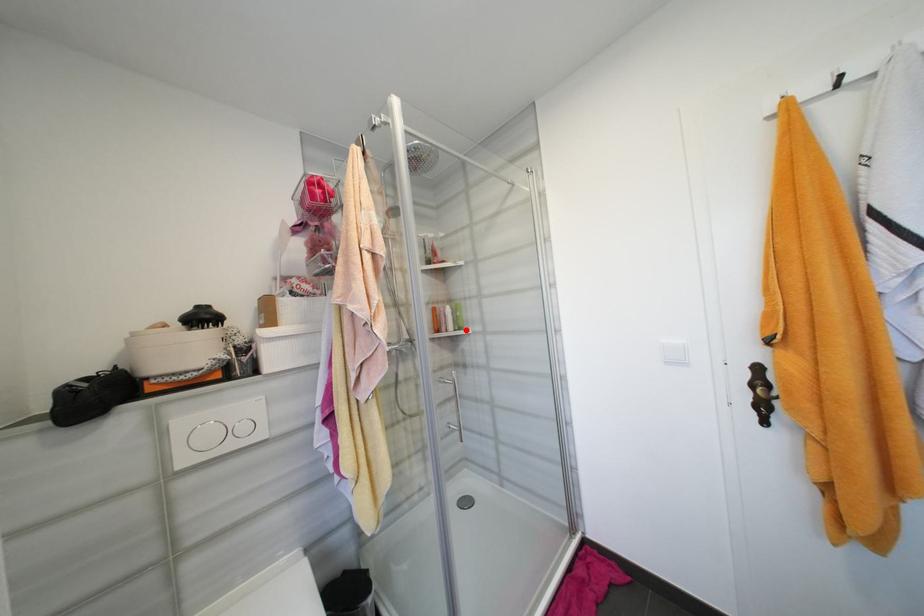
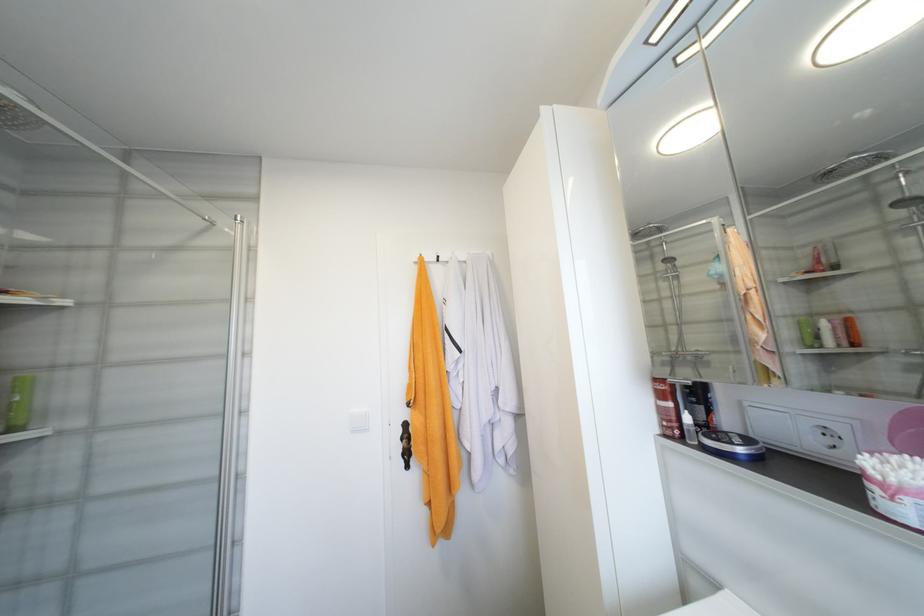
The point at the highlighted location is marked in the first image. Where is the corresponding point in the second image?

(19, 430)